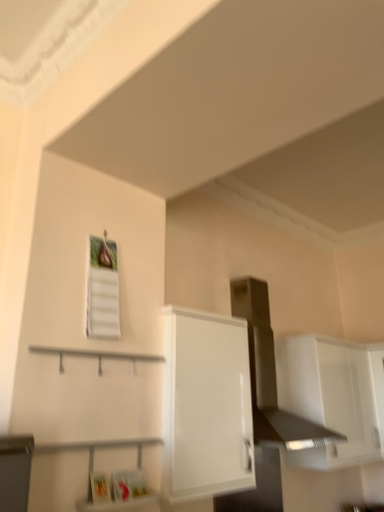
Question: Based on their sizes in the image, would you say satin silver vent at upper center is bigger or smaller than white glossy cabinet at center, which appears as the 1th cabinetry when viewed from the front?

Choices:
 (A) big
 (B) small

Answer: (A)

Question: From the image's perspective, is satin silver vent at upper center above or below white glossy cabinet at center, the 2th cabinetry in the right-to-left sequence?

Choices:
 (A) above
 (B) below

Answer: (A)

Question: Based on their relative distances, which object is farther from the white glossy cabinet at upper right, the first cabinetry when ordered from right to left?

Choices:
 (A) white glossy cabinet at center, the 2th cabinetry when ordered from back to front
 (B) satin silver vent at upper center

Answer: (A)

Question: Which object is positioned farthest from the white glossy cabinet at upper right, the second cabinetry when ordered from left to right?

Choices:
 (A) white glossy cabinet at center, the 2th cabinetry when ordered from back to front
 (B) satin silver vent at upper center

Answer: (A)